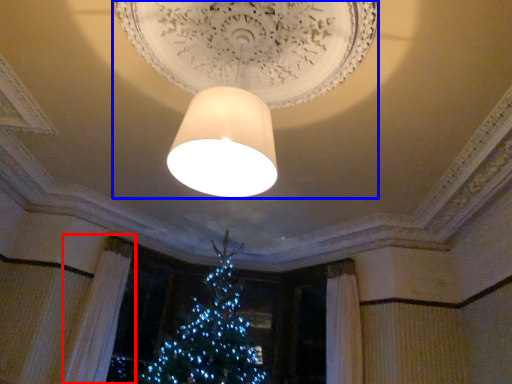
Question: Which object appears farthest to the camera in this image, curtain (highlighted by a red box) or lamp (highlighted by a blue box)?

Choices:
 (A) curtain
 (B) lamp

Answer: (A)